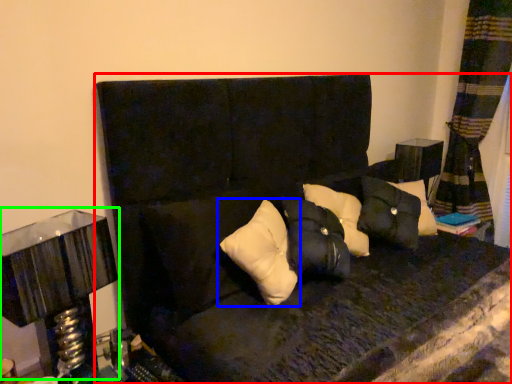
Question: Based on their relative distances, which object is nearer to furniture (highlighted by a red box)? Choose from pillow (highlighted by a blue box) and table lamp (highlighted by a green box).

Choices:
 (A) pillow
 (B) table lamp

Answer: (A)